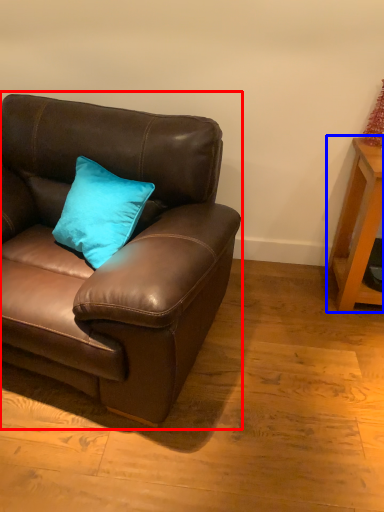
Question: Which of the following is the closest to the observer, studio couch (highlighted by a red box) or table (highlighted by a blue box)?

Choices:
 (A) studio couch
 (B) table

Answer: (A)